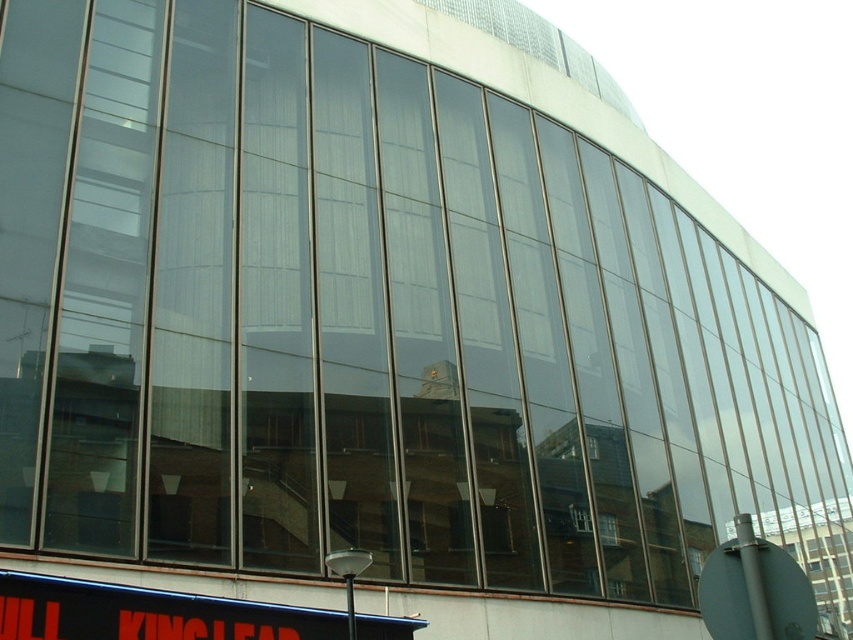
Question: Is black plastic sign at lower left thinner than metallic gray sign at lower right?

Choices:
 (A) yes
 (B) no

Answer: (B)

Question: Does black plastic sign at lower left have a greater width compared to metallic gray sign at lower right?

Choices:
 (A) yes
 (B) no

Answer: (A)

Question: Which point is farther to the camera?

Choices:
 (A) (264, 634)
 (B) (753, 621)

Answer: (A)

Question: Can you confirm if black plastic sign at lower left is wider than metallic gray sign at lower right?

Choices:
 (A) no
 (B) yes

Answer: (B)

Question: Which point is farther from the camera taking this photo?

Choices:
 (A) (224, 624)
 (B) (704, 602)

Answer: (A)